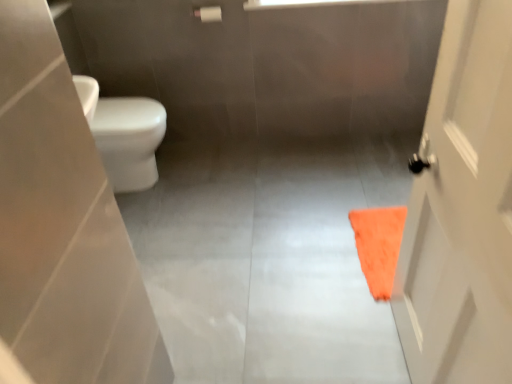
I want to click on white glossy bidet at left, so click(x=129, y=140).

This screenshot has height=384, width=512. Describe the element at coordinates (129, 140) in the screenshot. I see `white glossy bidet at left` at that location.

Image resolution: width=512 pixels, height=384 pixels. What are the coordinates of `white glossy bidet at left` in the screenshot? It's located at (129, 140).